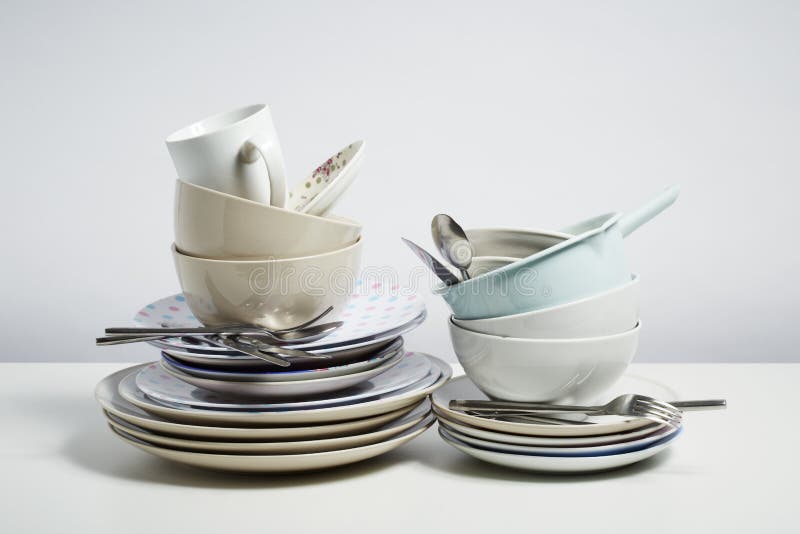
At what (x,y) coordinates should I click in order to perform the action: click on silverware. Please return your answer as a coordinate pair (x, y). The height and width of the screenshot is (534, 800). Looking at the image, I should click on click(x=640, y=405), click(x=566, y=417), click(x=276, y=362), click(x=296, y=357), click(x=288, y=336), click(x=140, y=337).